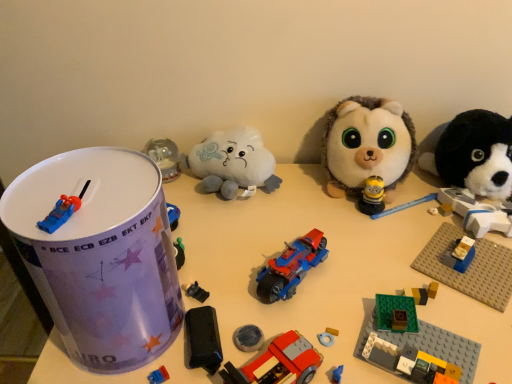
You are a GUI agent. You are given a task and a screenshot of the screen. Output one action in this format:
    pyautogui.click(x=<x>, y=<y>)
    Task: Click on the empty space that is in between shiny plastic motorcycle at center, which is the sixth toy in left-to-right order, and black plush dog at right, positioned as the 9th toy in left-to-right order
    
    Given the screenshot: What is the action you would take?
    pyautogui.click(x=400, y=241)